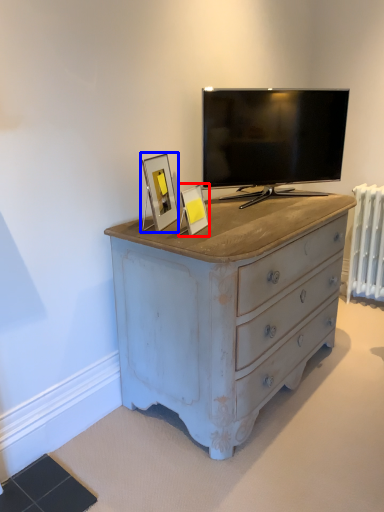
Question: Which object is further to the camera taking this photo, picture frame (highlighted by a red box) or picture frame (highlighted by a blue box)?

Choices:
 (A) picture frame
 (B) picture frame

Answer: (B)